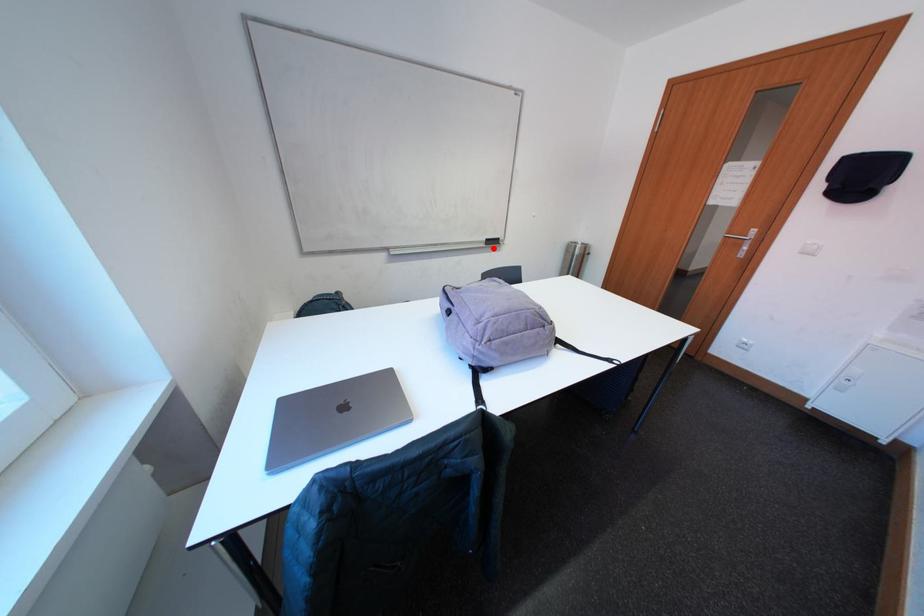
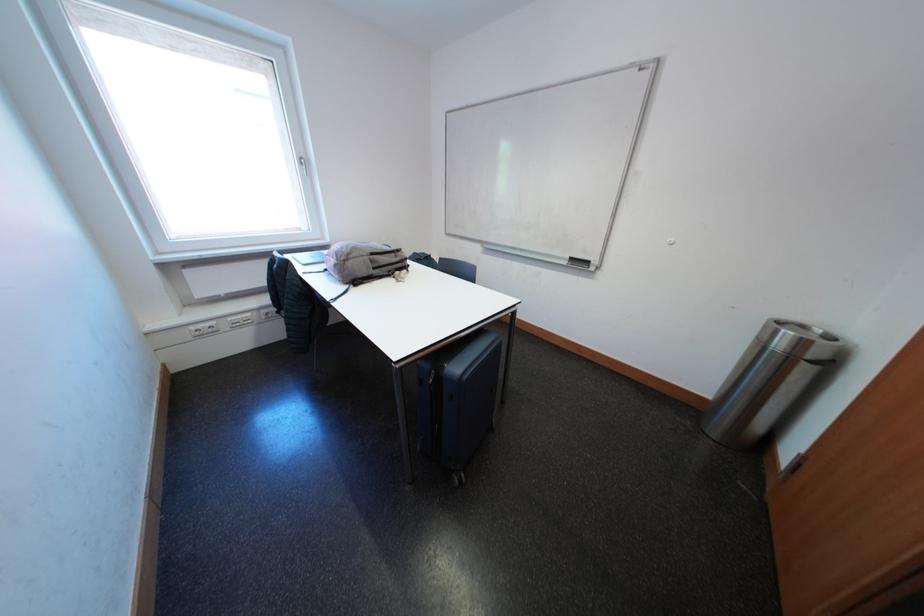
Question: I am providing you with two images of the same scene from different viewpoints. Image1 has a red point marked. In image2, the corresponding 3D location appears at what relative position? Reply with the corresponding letter.

Choices:
 (A) Closer
 (B) Farther

Answer: (A)